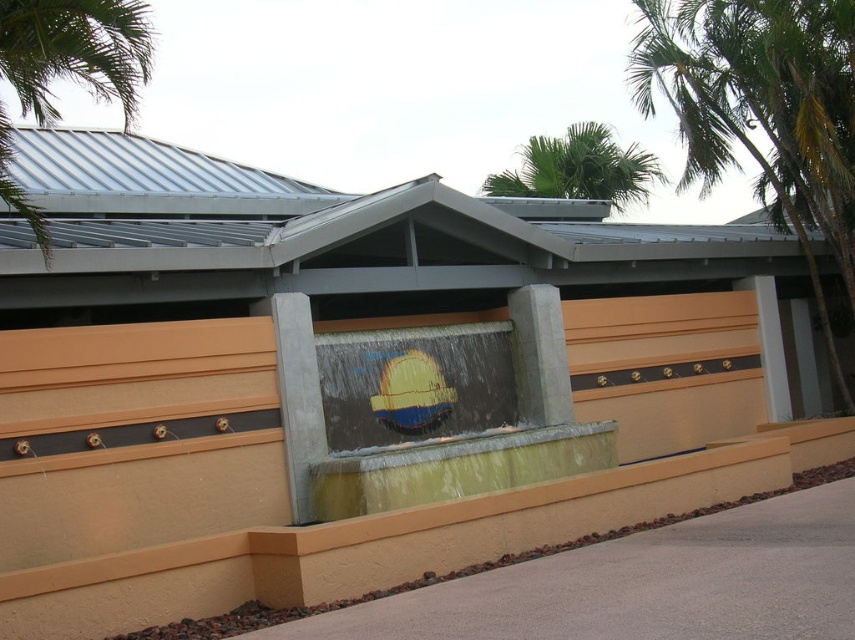
Does green leafy palm tree at upper center appear under concrete at center?

No, green leafy palm tree at upper center is not below concrete at center.

Between green leafy palm tree at upper center and concrete at center, which one is positioned lower?

concrete at center

In order to click on green leafy palm tree at upper center in this screenshot , I will do `click(579, 168)`.

The image size is (855, 640). In order to click on green leafy palm tree at upper center in this screenshot , I will do `click(579, 168)`.

Can you confirm if green leafy palm tree at upper right is positioned to the left of concrete at center?

Incorrect, green leafy palm tree at upper right is not on the left side of concrete at center.

Is point (823, 323) behind point (555, 396)?

Yes, it is behind point (555, 396).

Who is more distant from viewer, (805, 90) or (532, 369)?

The point (805, 90) is more distant.

The height and width of the screenshot is (640, 855). What are the coordinates of `green leafy palm tree at upper right` in the screenshot? It's located at (758, 115).

Is point (314, 348) positioned in front of point (534, 294)?

That is True.

Is gray concrete pillar at center to the left of concrete at center from the viewer's perspective?

Indeed, gray concrete pillar at center is positioned on the left side of concrete at center.

Is point (302, 304) farther from camera compared to point (541, 369)?

No, (302, 304) is in front of (541, 369).

The image size is (855, 640). I want to click on gray concrete pillar at center, so click(298, 396).